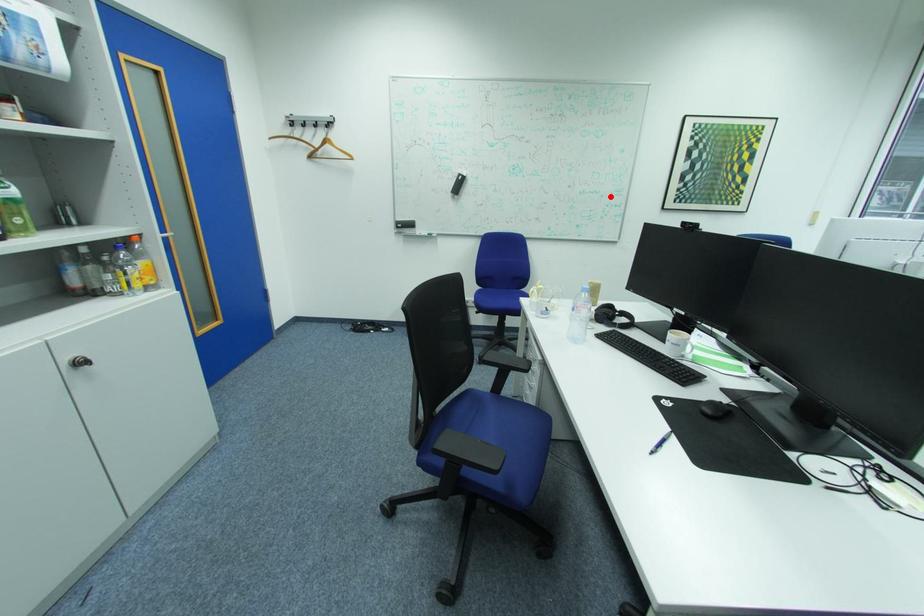
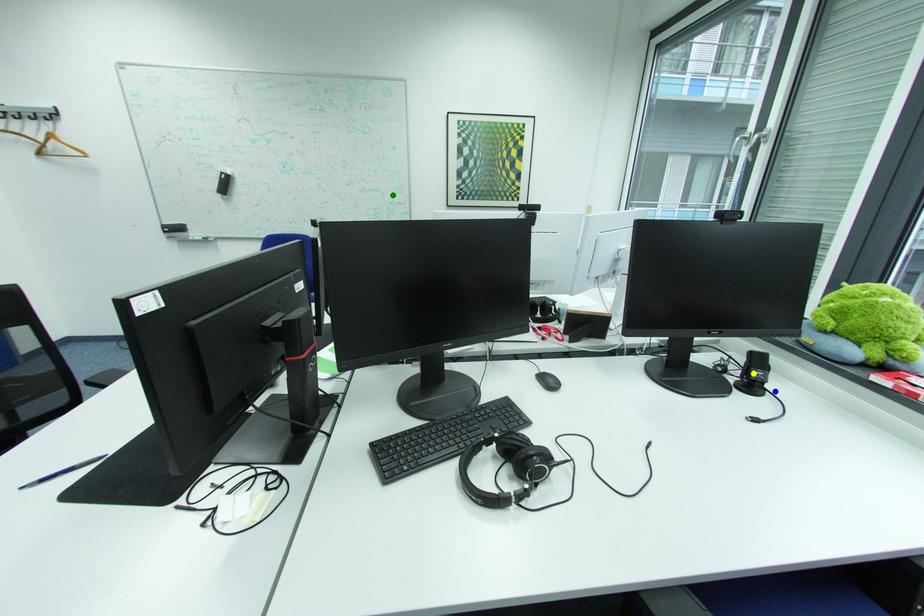
Question: I am providing you with two images of the same scene from different viewpoints. A red point is marked on the first image. You are given multiple points on the second image. Can you choose the point in image 2 that corresponds to the point in image 1?

Choices:
 (A) green point
 (B) yellow point
 (C) blue point

Answer: (A)